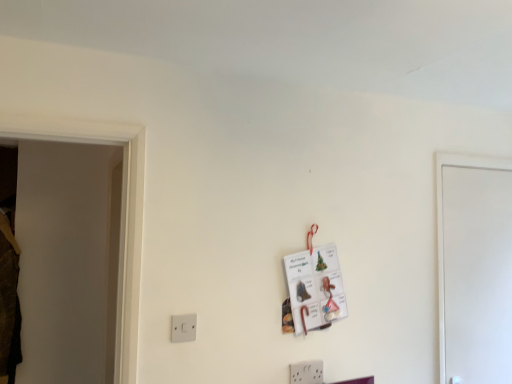
Question: Relative to white matte door at right, is white plastic light switch at lower left in front or behind?

Choices:
 (A) front
 (B) behind

Answer: (A)

Question: From their relative heights in the image, would you say white plastic light switch at lower left is taller or shorter than white matte door at right?

Choices:
 (A) short
 (B) tall

Answer: (A)

Question: Is white plastic light switch at lower left inside or outside of white matte door at right?

Choices:
 (A) outside
 (B) inside

Answer: (A)

Question: In terms of height, does white matte door at right look taller or shorter compared to white plastic light switch at lower left?

Choices:
 (A) short
 (B) tall

Answer: (B)

Question: In the image, is white matte door at right positioned in front of or behind white plastic light switch at lower left?

Choices:
 (A) behind
 (B) front

Answer: (A)

Question: Considering the positions of point (480, 218) and point (174, 319), is point (480, 218) closer or farther from the camera than point (174, 319)?

Choices:
 (A) farther
 (B) closer

Answer: (A)

Question: Visually, is white matte door at right positioned to the left or to the right of white plastic light switch at lower left?

Choices:
 (A) right
 (B) left

Answer: (A)